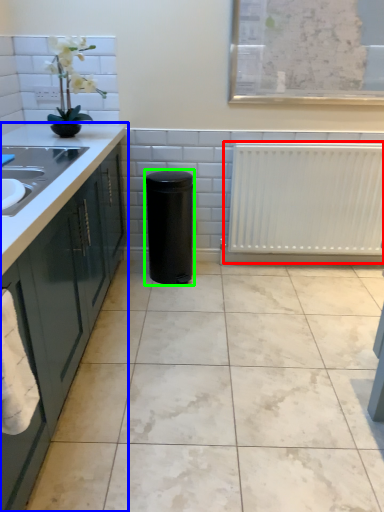
Question: Based on their relative distances, which object is nearer to radiator (highlighted by a red box)? Choose from countertop (highlighted by a blue box) and appliance (highlighted by a green box).

Choices:
 (A) countertop
 (B) appliance

Answer: (B)